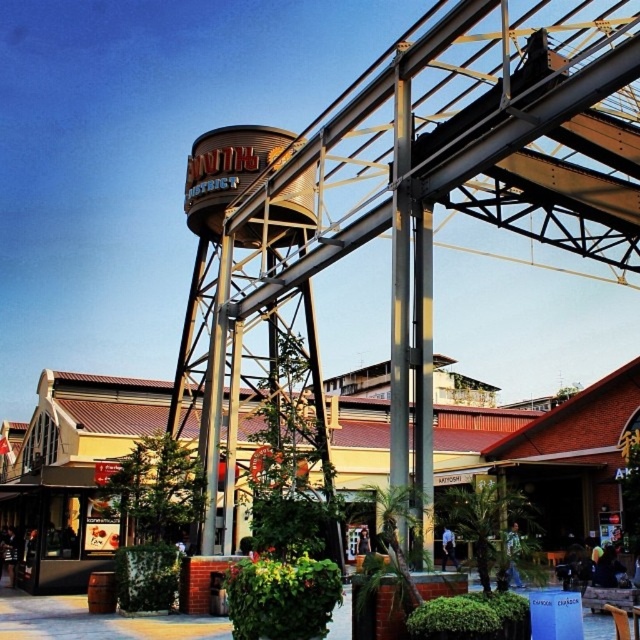
You are standing in the middle of the urban scene and want to take a photo of both the brown metallic water tower at center and the brown wooden amusement park at center. Which object should you focus on first to ensure both are in frame?

You should focus on the brown metallic water tower at center first since it is closer to you than the brown wooden amusement park at center, allowing both to be in frame by adjusting the camera angle accordingly.

You are standing at the camera position and want to take a photo of the brown metallic water tower at center. If your camera has a maximum focus range of 25 meters, will you be able to capture it clearly?

The brown metallic water tower at center is 28.62 meters away from camera, which exceeds the camera maximum focus range of 25 meters. Therefore, you won be able to capture it clearly.

Consider the image. You are standing at the entrance of the brown wooden amusement park at center and want to go to the brown metallic water tower at center. Which direction should you walk?

The brown metallic water tower at center is to the right of the brown wooden amusement park at center, so you should walk to the right to reach it.